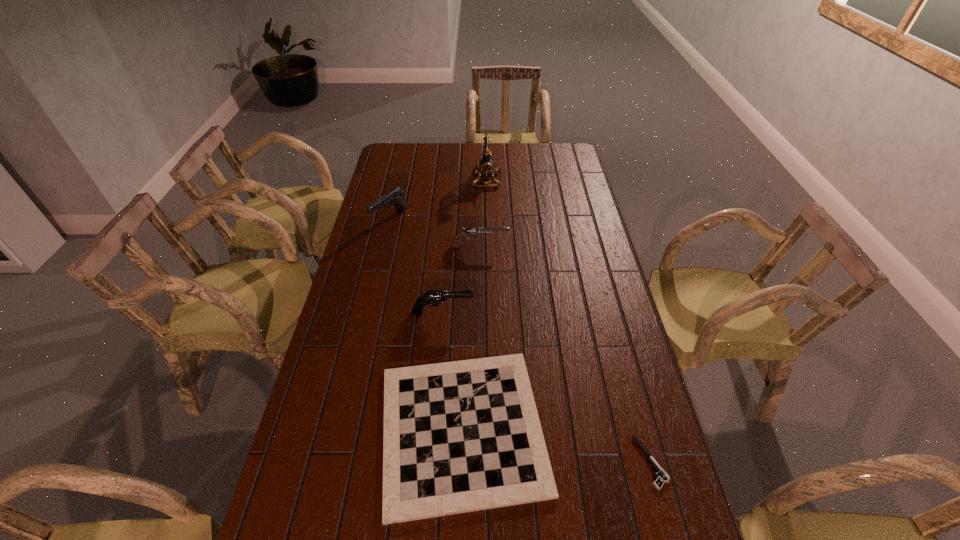
The width and height of the screenshot is (960, 540). What are the coordinates of `free region located on the front-facing side of the shortest object` in the screenshot? It's located at (509, 462).

The height and width of the screenshot is (540, 960). I want to click on object located in the left edge section of the desktop, so click(x=394, y=197).

Identify the location of object that is at the right edge. The image size is (960, 540). click(663, 477).

In the image, there is a desktop. Find the location of `vacant space at the far edge`. vacant space at the far edge is located at coordinates (499, 160).

Where is `vacant space at the left edge of the desktop`? The height and width of the screenshot is (540, 960). vacant space at the left edge of the desktop is located at coordinates click(x=363, y=401).

Where is `vacant area at the right edge of the desktop`? Image resolution: width=960 pixels, height=540 pixels. vacant area at the right edge of the desktop is located at coordinates 561,226.

Find the location of a particular element. The height and width of the screenshot is (540, 960). vacant position at the far left corner of the desktop is located at coordinates (405, 158).

This screenshot has width=960, height=540. I want to click on vacant space at the far right corner of the desktop, so click(x=548, y=161).

This screenshot has width=960, height=540. Identify the location of free area in between the farthest gun and the nearest gun. (417, 266).

Locate an element on the screen. free point between the leftmost object and the checkerboard is located at coordinates (426, 324).